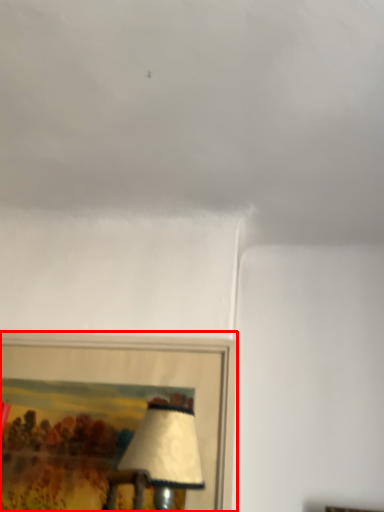
Question: Observing the image, what is the correct spatial positioning of picture frame (annotated by the red box) in reference to cloud?

Choices:
 (A) left
 (B) right

Answer: (A)